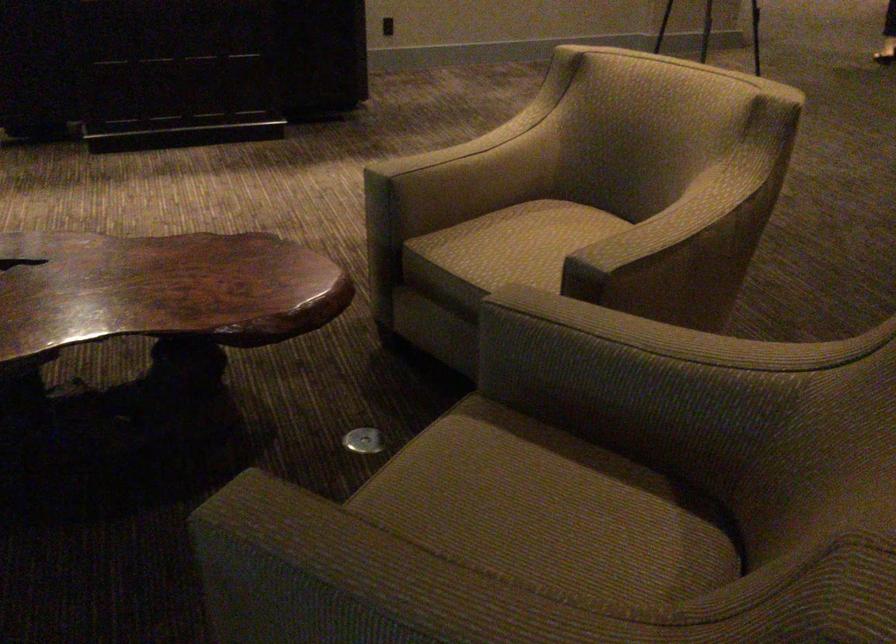
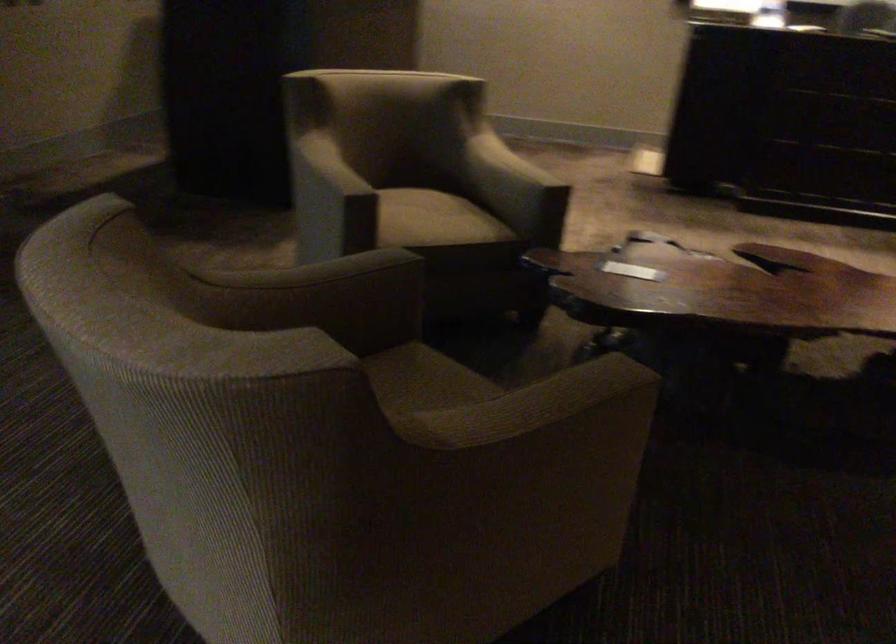
Question: The first image is from the beginning of the video and the second image is from the end. How did the camera likely rotate when shooting the video?

Choices:
 (A) Left
 (B) Right
 (C) Up
 (D) Down

Answer: (A)